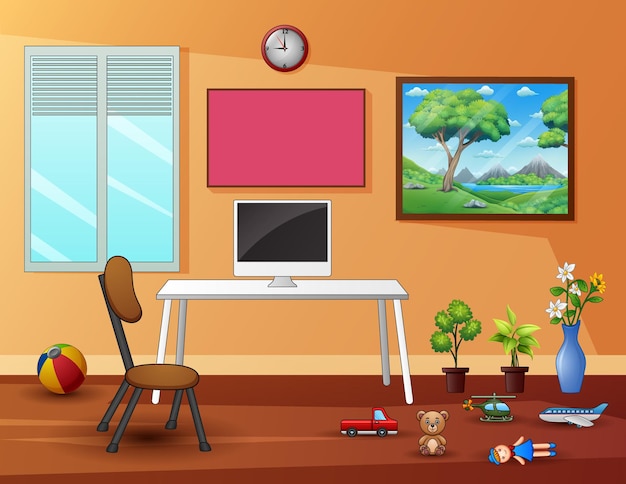
This screenshot has height=484, width=626. Find the location of `pot for plant`. pot for plant is located at coordinates (510, 379).